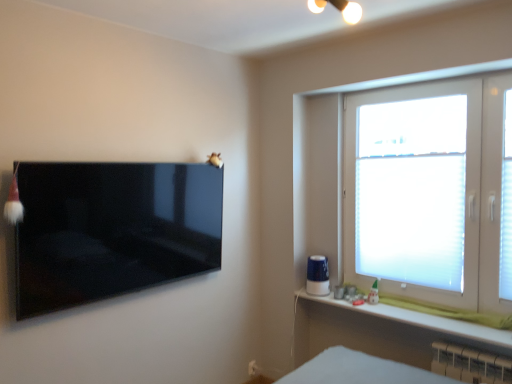
I want to click on empty space that is ontop of white translucent blinds at right, so click(403, 156).